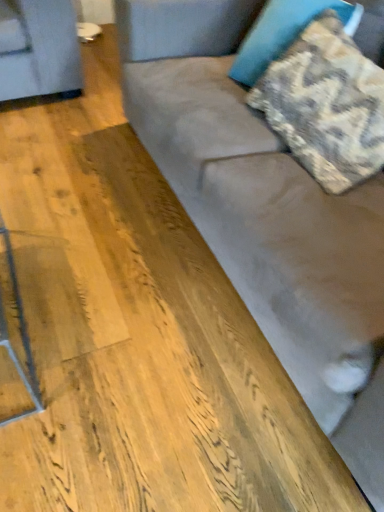
Question: Considering the positions of textured beige pillow at upper right, positioned as the 2th pillow in top-to-bottom order, and camouflage fabric pillow at upper right, which appears as the first pillow when viewed from the top, in the image, is textured beige pillow at upper right, positioned as the 2th pillow in top-to-bottom order, bigger or smaller than camouflage fabric pillow at upper right, which appears as the first pillow when viewed from the top,?

Choices:
 (A) big
 (B) small

Answer: (A)

Question: Does point (332, 44) appear closer or farther from the camera than point (274, 20)?

Choices:
 (A) closer
 (B) farther

Answer: (A)

Question: Which object is positioned farthest from the camouflage fabric pillow at upper right, which is the second pillow from bottom to top?

Choices:
 (A) textured beige pillow at upper right, positioned as the 2th pillow in top-to-bottom order
 (B) suede couch at center

Answer: (B)

Question: Estimate the real-world distances between objects in this image. Which object is farther from the textured beige pillow at upper right, positioned as the 2th pillow in top-to-bottom order?

Choices:
 (A) suede couch at center
 (B) camouflage fabric pillow at upper right, which appears as the first pillow when viewed from the top

Answer: (A)